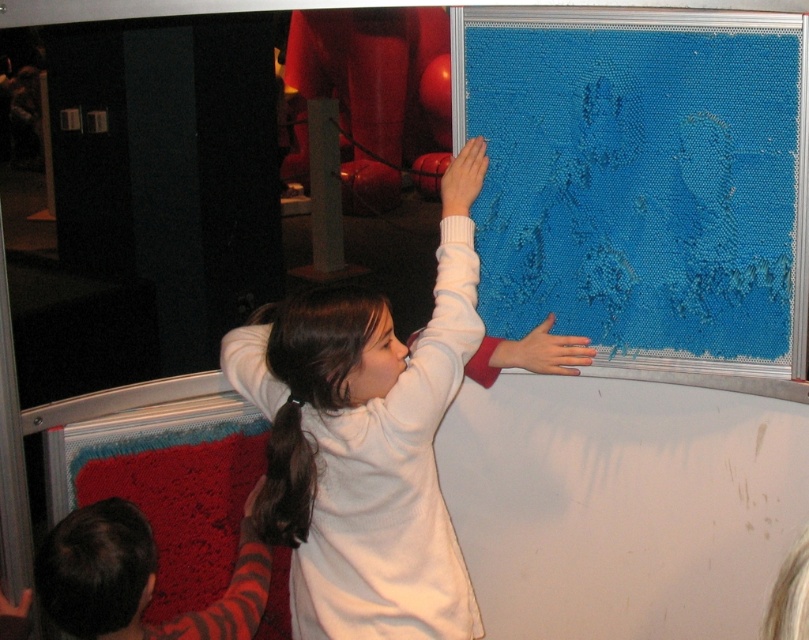
Question: Can you confirm if blue textured fabric at upper right is bigger than white matte sweater at upper center?

Choices:
 (A) yes
 (B) no

Answer: (B)

Question: Which point appears closest to the camera in this image?

Choices:
 (A) (242, 394)
 (B) (638, 180)

Answer: (A)

Question: Is blue textured fabric at upper right thinner than white matte sweater at upper center?

Choices:
 (A) no
 (B) yes

Answer: (A)

Question: Which of the following is the farthest from the observer?

Choices:
 (A) click(354, 477)
 (B) click(726, 61)

Answer: (B)

Question: Is blue textured fabric at upper right below white matte sweater at upper center?

Choices:
 (A) no
 (B) yes

Answer: (A)